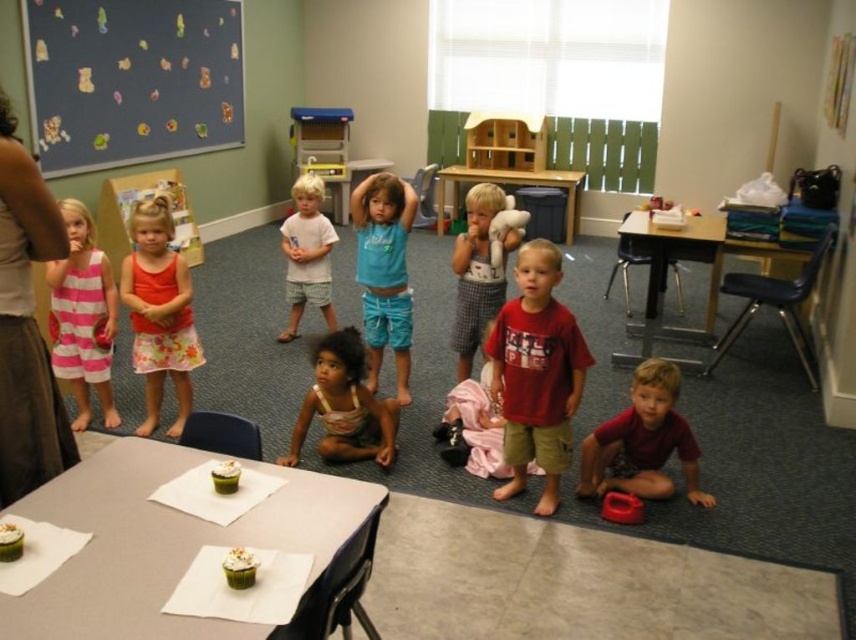
Can you confirm if red matte shirt at center is smaller than floral skirt at center?

Correct, red matte shirt at center occupies less space than floral skirt at center.

Who is positioned more to the right, red matte shirt at center or floral skirt at center?

red matte shirt at center is more to the right.

Find the location of `red matte shirt at center`. red matte shirt at center is located at coordinates (536, 372).

Does striped cotton dress at left have a larger size compared to light brown cotton shirt at center?

No.

Is striped cotton dress at left wider than light brown cotton shirt at center?

Correct, the width of striped cotton dress at left exceeds that of light brown cotton shirt at center.

Is point (90, 372) behind point (492, 196)?

No, (90, 372) is closer to viewer.

Identify the location of striped cotton dress at left. This screenshot has width=856, height=640. (82, 317).

Can you confirm if blue felt bulletin board at upper left is taller than striped cotton dress at left?

Indeed, blue felt bulletin board at upper left has a greater height compared to striped cotton dress at left.

Find the location of a particular element. The image size is (856, 640). blue felt bulletin board at upper left is located at coordinates (131, 80).

Is point (141, 90) positioned in front of point (62, 358)?

No, it is behind (62, 358).

At what (x,y) coordinates should I click in order to perform the action: click on blue felt bulletin board at upper left. Please return your answer as a coordinate pair (x, y). The height and width of the screenshot is (640, 856). Looking at the image, I should click on (131, 80).